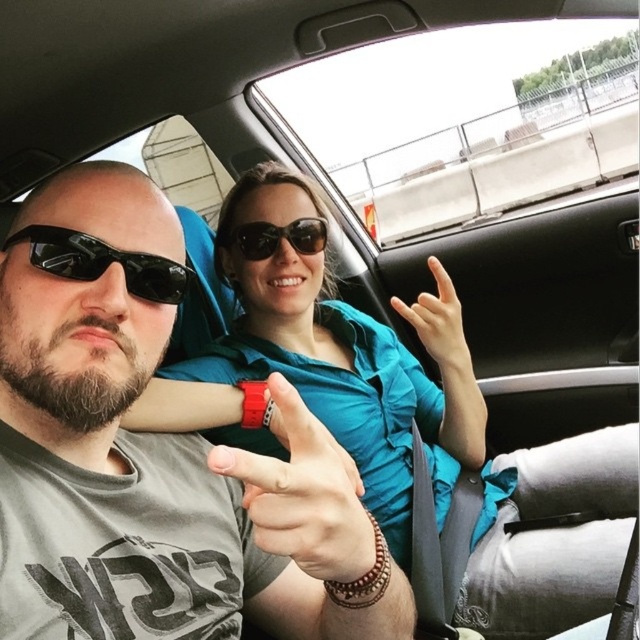
Question: Where is black matte sunglasses at left located in relation to blue fabric hand at center in the image?

Choices:
 (A) left
 (B) right

Answer: (A)

Question: Where is red plastic watch at center located in relation to black matte sunglasses at left in the image?

Choices:
 (A) right
 (B) left

Answer: (A)

Question: Estimate the real-world distances between objects in this image. Which object is farther from the black matte sunglasses at left?

Choices:
 (A) blue fabric hand at center
 (B) matte black sunglasses at center

Answer: (A)

Question: Does gray matte t-shirt at center appear on the right side of black matte sunglasses at left?

Choices:
 (A) no
 (B) yes

Answer: (B)

Question: Considering the real-world distances, which object is farthest from the matte black sunglasses at center?

Choices:
 (A) red plastic watch at center
 (B) gray matte t-shirt at center
 (C) black matte sunglasses at left

Answer: (A)

Question: Which object is the closest to the matte black sunglasses at center?

Choices:
 (A) red plastic watch at center
 (B) blue fabric hand at center
 (C) gray matte t-shirt at center

Answer: (B)